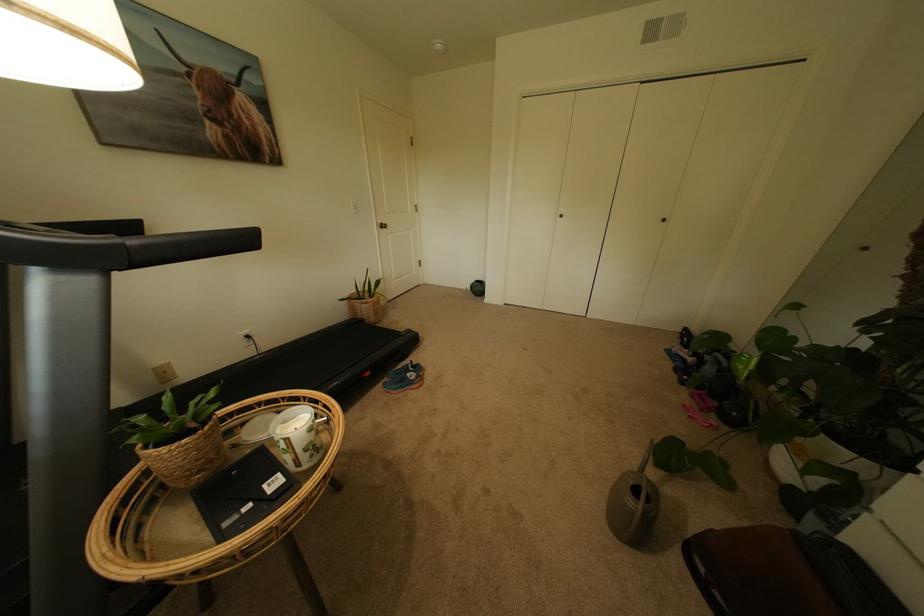
Where would you lift the green ball? Please return your answer as a coordinate pair (x, y).

(477, 288)